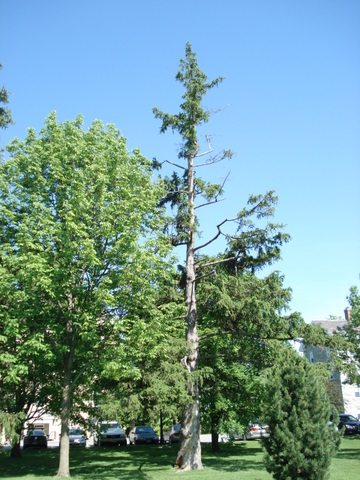
At what (x,y) coordinates should I click in order to perform the action: click on hood. Please return your answer as a coordinate pair (x, y). The height and width of the screenshot is (480, 360). Looking at the image, I should click on (77, 436), (145, 434), (110, 431), (353, 421).